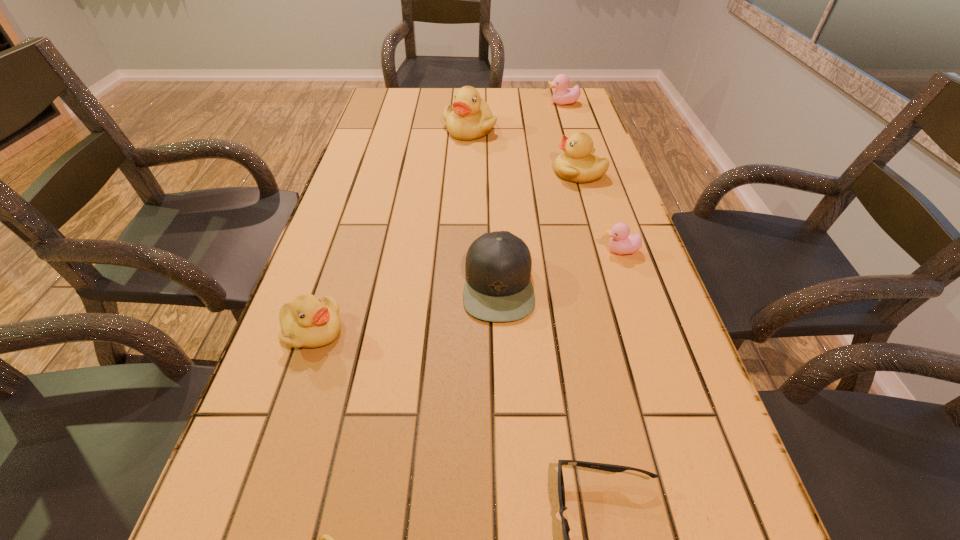
Locate an element on the screen. the farthest yellow duckling is located at coordinates (470, 118).

The width and height of the screenshot is (960, 540). I want to click on the seventh nearest object, so click(470, 118).

Image resolution: width=960 pixels, height=540 pixels. Find the location of `the second biggest yellow duckling`. the second biggest yellow duckling is located at coordinates pos(578,163).

The height and width of the screenshot is (540, 960). Find the location of `the fourth nearest duckling`. the fourth nearest duckling is located at coordinates (578, 163).

You are a GUI agent. You are given a task and a screenshot of the screen. Output one action in this format:
    pyautogui.click(x=<x>, y=<y>)
    Task: Click on the farther pink duckling
    This screenshot has width=960, height=540.
    Given the screenshot: What is the action you would take?
    pyautogui.click(x=561, y=96)

Where is `the farthest object`? the farthest object is located at coordinates (561, 96).

This screenshot has height=540, width=960. What are the coordinates of `cap` in the screenshot? It's located at (498, 288).

This screenshot has height=540, width=960. I want to click on the leftmost duckling, so click(308, 322).

Identify the location of the leftmost yellow duckling. [x=308, y=322].

The width and height of the screenshot is (960, 540). I want to click on the smaller pink duckling, so click(621, 242).